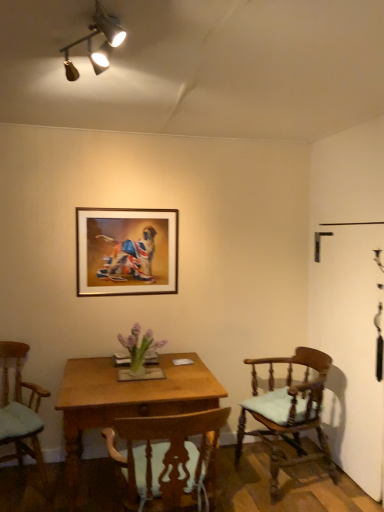
Measure the distance between point [185,433] and camera.

5.91 feet.

The width and height of the screenshot is (384, 512). Describe the element at coordinates (168, 457) in the screenshot. I see `wooden chair at center, which is counted as the 2th chair, starting from the left` at that location.

In the scene shown: Measure the distance between point (2, 437) and camera.

Point (2, 437) is 7.80 feet away from camera.

Identify the location of wooden desk at center. This screenshot has width=384, height=512. point(126,400).

Locate an element on the screen. The image size is (384, 512). wooden chair at center, which appears as the second chair when viewed from the right is located at coordinates (168, 457).

From a real-world perspective, which is physically above, light green fabric chair at lower left, the first chair viewed from the left, or light brown wood chair at right, which is the third chair in left-to-right order?

light green fabric chair at lower left, the first chair viewed from the left, is physically above.

Can you see light green fabric chair at lower left, the first chair viewed from the left, touching light brown wood chair at right, marked as the first chair in a right-to-left arrangement?

No, light green fabric chair at lower left, the first chair viewed from the left, is not making contact with light brown wood chair at right, marked as the first chair in a right-to-left arrangement.

Does point (43, 478) come behind point (296, 352)?

No, (43, 478) is closer to viewer.

You are a GUI agent. You are given a task and a screenshot of the screen. Output one action in this format:
    pyautogui.click(x=<x>, y=<y>)
    Task: Click on the chair that is the 1st one when counting forward from the light brown wood chair at right, which is the third chair in left-to-right order
    The height and width of the screenshot is (512, 384).
    Given the screenshot: What is the action you would take?
    pyautogui.click(x=20, y=410)

From the image's perspective, is light brown wood chair at right, which is the third chair in left-to-right order, located beneath gold-framed picture at upper center?

Indeed, from the image's perspective, light brown wood chair at right, which is the third chair in left-to-right order, is shown beneath gold-framed picture at upper center.

Which of these two, light brown wood chair at right, which is the third chair in left-to-right order, or gold-framed picture at upper center, is wider?

Wider between the two is light brown wood chair at right, which is the third chair in left-to-right order.

From a real-world perspective, is light brown wood chair at right, which is the third chair in left-to-right order, over gold-framed picture at upper center?

No, from a real-world perspective, light brown wood chair at right, which is the third chair in left-to-right order, is not over gold-framed picture at upper center

Is gold-framed picture at upper center next to wooden chair at center, which appears as the second chair when viewed from the right?

No, gold-framed picture at upper center is not next to wooden chair at center, which appears as the second chair when viewed from the right.

Can you confirm if gold-framed picture at upper center is positioned to the right of wooden chair at center, which is counted as the 2th chair, starting from the left?

No.

In the scene shown: Is gold-framed picture at upper center oriented away from wooden chair at center, which is counted as the 2th chair, starting from the left?

That's not correct — gold-framed picture at upper center is not looking away from wooden chair at center, which is counted as the 2th chair, starting from the left.

Can you tell me how much gold-framed picture at upper center and wooden chair at center, which is counted as the 2th chair, starting from the left, differ in facing direction?

177 degrees separate the facing orientations of gold-framed picture at upper center and wooden chair at center, which is counted as the 2th chair, starting from the left.

From a real-world perspective, relative to wooden chair at center, which is counted as the 2th chair, starting from the left, is light green fabric chair at lower left, the first chair viewed from the left, vertically above or below?

light green fabric chair at lower left, the first chair viewed from the left, is below wooden chair at center, which is counted as the 2th chair, starting from the left.

Which is closer, (3, 431) or (214, 432)?

Point (3, 431)

Is wooden chair at center, which appears as the second chair when viewed from the right, completely or partially inside light green fabric chair at lower left, the third chair positioned from the right?

No.

In terms of width, does light green fabric chair at lower left, the third chair positioned from the right, look wider or thinner when compared to wooden chair at center, which appears as the second chair when viewed from the right?

Clearly, light green fabric chair at lower left, the third chair positioned from the right, has more width compared to wooden chair at center, which appears as the second chair when viewed from the right.

In the scene shown: Is wooden desk at center taller or shorter than gold-framed picture at upper center?

wooden desk at center is taller than gold-framed picture at upper center.

What's the angular difference between wooden desk at center and gold-framed picture at upper center's facing directions?

The facing directions of wooden desk at center and gold-framed picture at upper center are 1.3 degrees apart.

Which is correct: wooden desk at center is inside gold-framed picture at upper center, or outside of it?

wooden desk at center is spatially situated outside gold-framed picture at upper center.

Is point (92, 362) closer to camera compared to point (84, 275)?

That is True.

Which of these two, light brown wood chair at right, marked as the first chair in a right-to-left arrangement, or light green fabric chair at lower left, the first chair viewed from the left, stands taller?

light green fabric chair at lower left, the first chair viewed from the left, is taller.

From the light brown wood chair at right, which is the third chair in left-to-right order, count the 2nd chair to the left and point to it. Please provide its 2D coordinates.

[(20, 410)]

Is light brown wood chair at right, marked as the first chair in a right-to-left arrangement, far away from light green fabric chair at lower left, the first chair viewed from the left?

Yes, light brown wood chair at right, marked as the first chair in a right-to-left arrangement, and light green fabric chair at lower left, the first chair viewed from the left, are quite far apart.

From the image's perspective, which chair is the 2nd one above the wooden desk at center? Please provide its 2D coordinates.

[(168, 457)]

From a real-world perspective, is wooden chair at center, which is counted as the 2th chair, starting from the left, physically located above or below wooden desk at center?

From a real-world perspective, wooden chair at center, which is counted as the 2th chair, starting from the left, is physically above wooden desk at center.

Is wooden chair at center, which appears as the second chair when viewed from the right, thinner than wooden desk at center?

Yes, wooden chair at center, which appears as the second chair when viewed from the right, is thinner than wooden desk at center.

Is wooden chair at center, which is counted as the 2th chair, starting from the left, directly adjacent to wooden desk at center?

No, wooden chair at center, which is counted as the 2th chair, starting from the left, is not making contact with wooden desk at center.

Which chair is the 2nd one when counting from the left side of the light brown wood chair at right, marked as the first chair in a right-to-left arrangement? Please provide its 2D coordinates.

[(20, 410)]

Locate an element on the screen. the 1st chair in front of the gold-framed picture at upper center, starting your count from the anchor is located at coordinates (288, 411).

Estimate the real-world distances between objects in this image. Which object is further from wooden chair at center, which is counted as the 2th chair, starting from the left, gold-framed picture at upper center or light green fabric chair at lower left, the first chair viewed from the left?

gold-framed picture at upper center is further to wooden chair at center, which is counted as the 2th chair, starting from the left.

From the image, which object appears to be farther from wooden chair at center, which is counted as the 2th chair, starting from the left, light brown wood chair at right, which is the third chair in left-to-right order, or light green fabric chair at lower left, the first chair viewed from the left?

light brown wood chair at right, which is the third chair in left-to-right order.

Looking at the image, which one is located further to wooden desk at center, light brown wood chair at right, which is the third chair in left-to-right order, or gold-framed picture at upper center?

gold-framed picture at upper center is positioned further to the anchor wooden desk at center.

Which object lies further to the anchor point light brown wood chair at right, which is the third chair in left-to-right order, light green fabric chair at lower left, the third chair positioned from the right, or wooden chair at center, which is counted as the 2th chair, starting from the left?

light green fabric chair at lower left, the third chair positioned from the right, is further to light brown wood chair at right, which is the third chair in left-to-right order.

When comparing their distances from wooden desk at center, does wooden chair at center, which is counted as the 2th chair, starting from the left, or gold-framed picture at upper center seem further?

The object further to wooden desk at center is gold-framed picture at upper center.

Estimate the real-world distances between objects in this image. Which object is closer to gold-framed picture at upper center, wooden desk at center or light brown wood chair at right, which is the third chair in left-to-right order?

wooden desk at center lies closer to gold-framed picture at upper center than the other object.

Which object lies nearer to the anchor point light brown wood chair at right, marked as the first chair in a right-to-left arrangement, wooden desk at center or light green fabric chair at lower left, the third chair positioned from the right?

Based on the image, wooden desk at center appears to be nearer to light brown wood chair at right, marked as the first chair in a right-to-left arrangement.

Looking at the image, which one is located further to light green fabric chair at lower left, the third chair positioned from the right, wooden chair at center, which appears as the second chair when viewed from the right, or gold-framed picture at upper center?

The object further to light green fabric chair at lower left, the third chair positioned from the right, is gold-framed picture at upper center.

Identify the location of desk located between light green fabric chair at lower left, the first chair viewed from the left, and wooden chair at center, which appears as the second chair when viewed from the right, in the left-right direction. (126, 400).

This screenshot has height=512, width=384. What are the coordinates of `picture frame located between light green fabric chair at lower left, the third chair positioned from the right, and light brown wood chair at right, marked as the first chair in a right-to-left arrangement, in the left-right direction` in the screenshot? It's located at (126, 251).

The height and width of the screenshot is (512, 384). Identify the location of chair between wooden desk at center and light brown wood chair at right, marked as the first chair in a right-to-left arrangement, from left to right. pos(168,457).

Where is `desk between light green fabric chair at lower left, the first chair viewed from the left, and light brown wood chair at right, which is the third chair in left-to-right order`? This screenshot has width=384, height=512. desk between light green fabric chair at lower left, the first chair viewed from the left, and light brown wood chair at right, which is the third chair in left-to-right order is located at coordinates (126, 400).